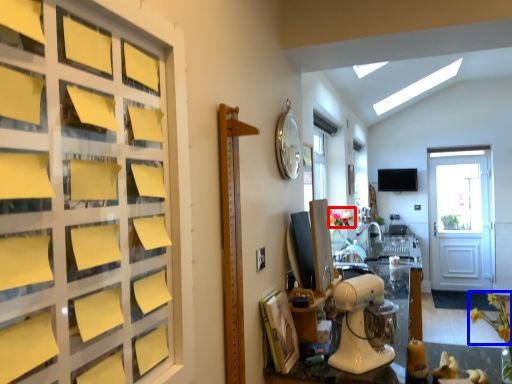
Question: Which point is closer to the camera, flower (highlighted by a red box) or flower (highlighted by a blue box)?

Choices:
 (A) flower
 (B) flower

Answer: (B)